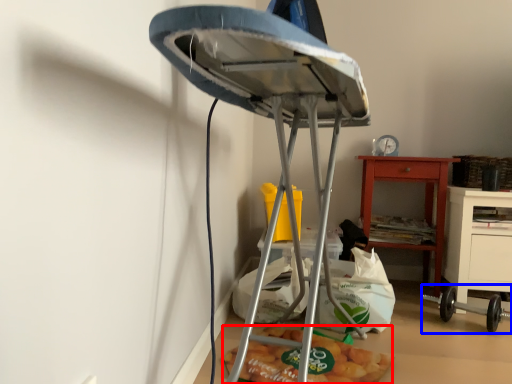
Question: Among these objects, which one is farthest to the camera, food (highlighted by a red box) or equipment (highlighted by a blue box)?

Choices:
 (A) food
 (B) equipment

Answer: (B)